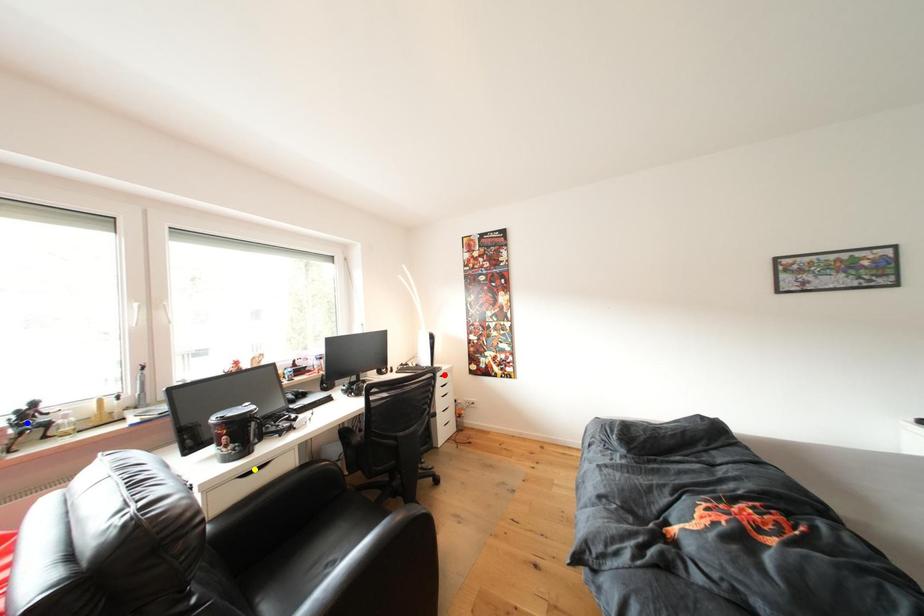
Order these from nearest to farthest:
1. yellow point
2. red point
3. blue point

red point < yellow point < blue point